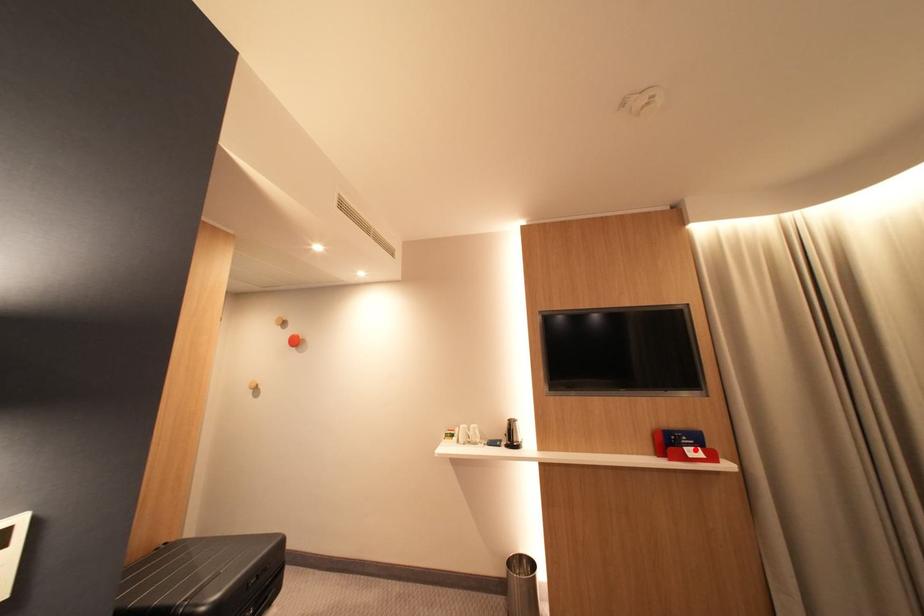
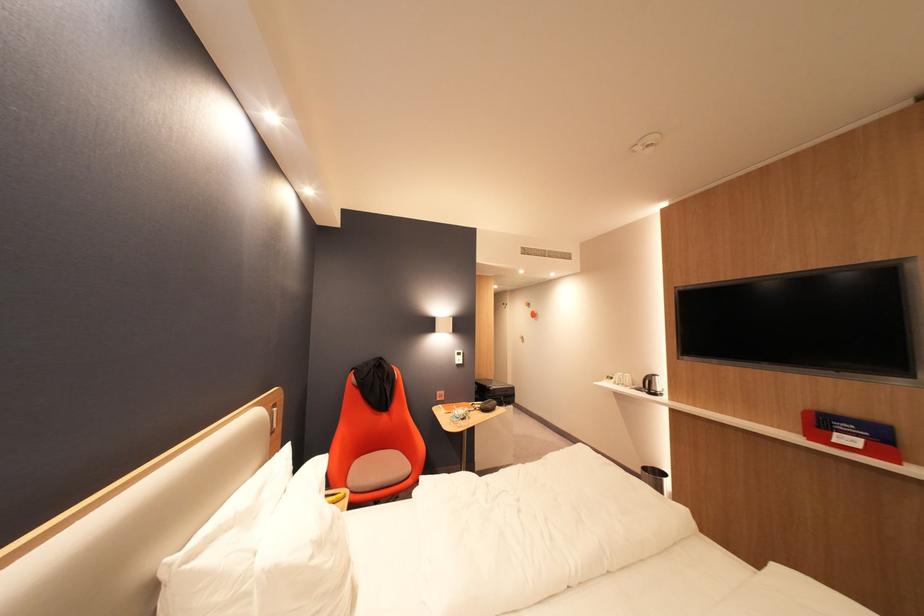
Question: I am providing you with two images of the same scene from different viewpoints. A red point is shown in image1. For the corresponding object point in image2, is it positioned nearer or farther from the camera?

Choices:
 (A) Nearer
 (B) Farther

Answer: (A)